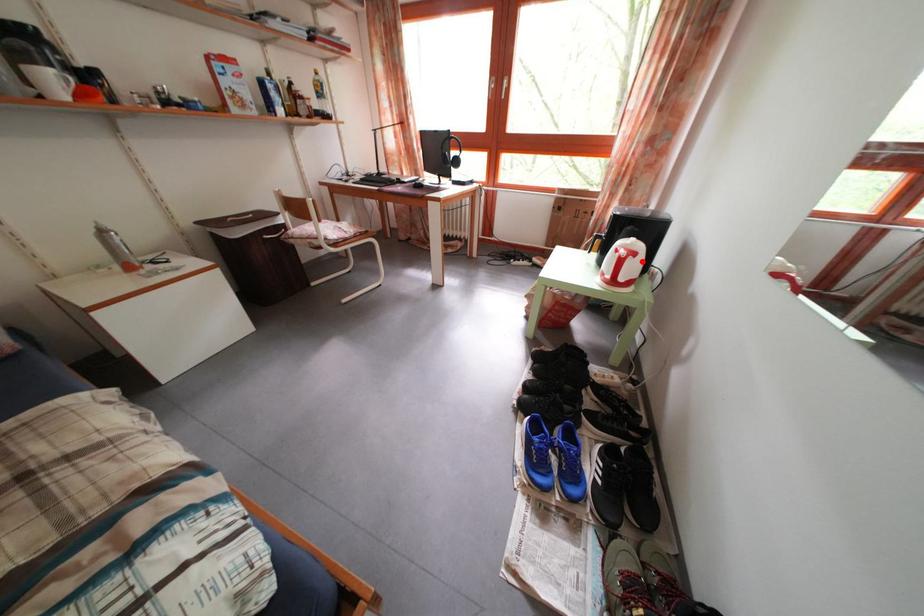
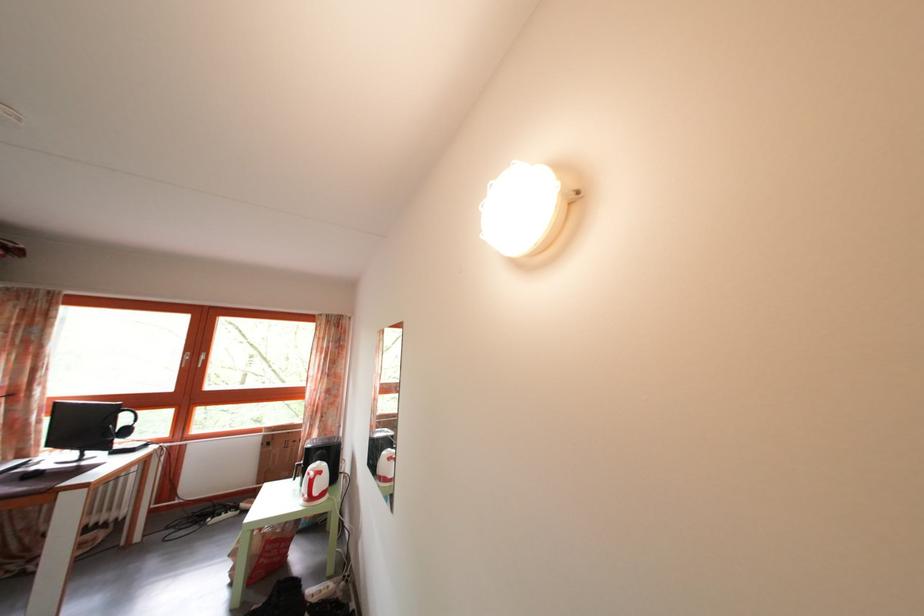
In the second image, find the point that corresponds to the highlighted location in the first image.

(327, 480)